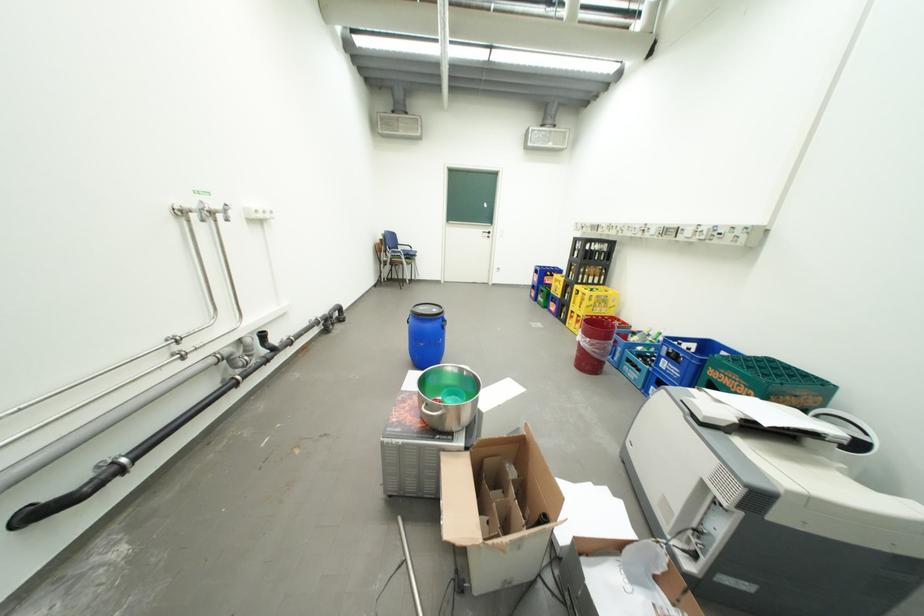
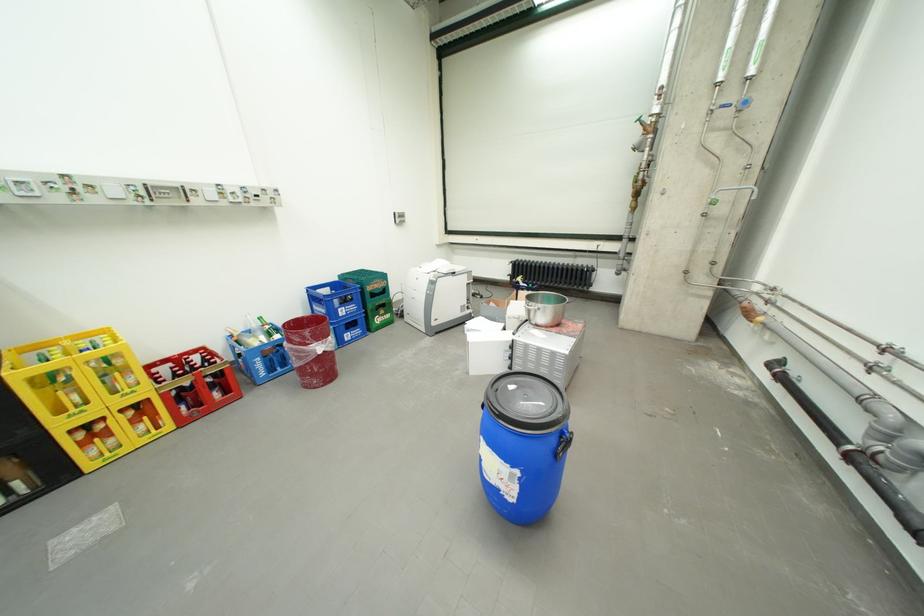
Find the pixel in the second image that matches [739,379] in the first image.

(386, 285)